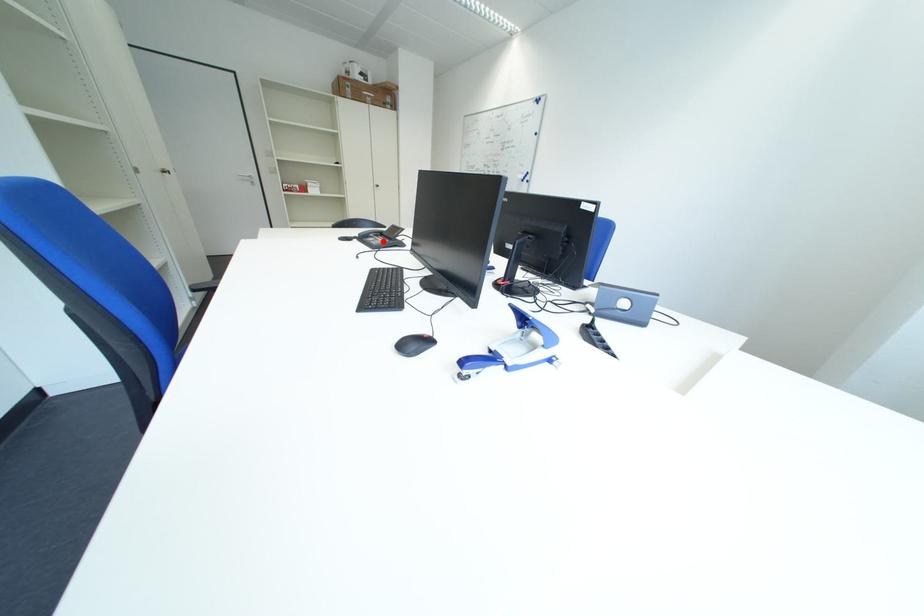
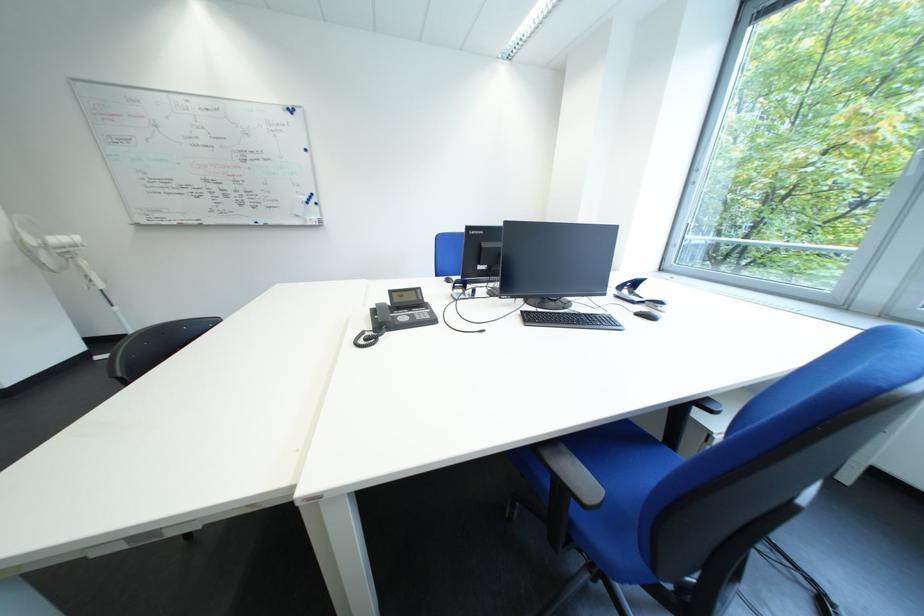
In the second image, find the point that corresponds to the highlighted location in the first image.

(416, 320)